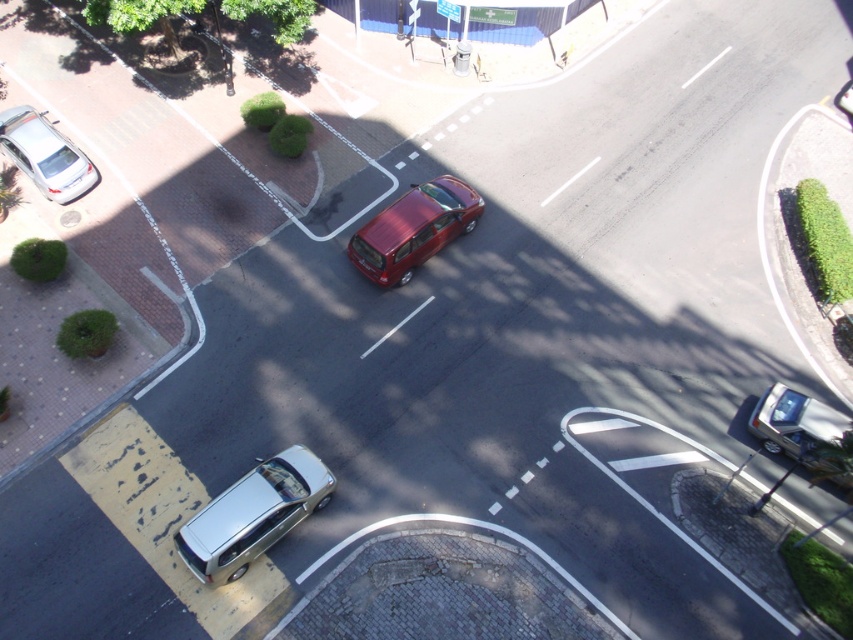
Question: Can you confirm if silver metallic van at lower left is positioned below metallic silver car at lower right?

Choices:
 (A) no
 (B) yes

Answer: (B)

Question: Which of the following is the closest to the observer?

Choices:
 (A) (779, 438)
 (B) (84, 179)
 (C) (404, 253)

Answer: (A)

Question: Which of these objects is positioned closest to the shiny red car at center?

Choices:
 (A) silver metallic van at lower left
 (B) silver metallic sedan at left
 (C) metallic silver car at lower right

Answer: (A)

Question: Can you confirm if silver metallic van at lower left is positioned above metallic silver car at lower right?

Choices:
 (A) yes
 (B) no

Answer: (B)

Question: Estimate the real-world distances between objects in this image. Which object is farther from the metallic silver car at lower right?

Choices:
 (A) silver metallic van at lower left
 (B) shiny red car at center
 (C) silver metallic sedan at left

Answer: (C)

Question: From the image, what is the correct spatial relationship of silver metallic van at lower left in relation to shiny red car at center?

Choices:
 (A) right
 (B) left

Answer: (B)